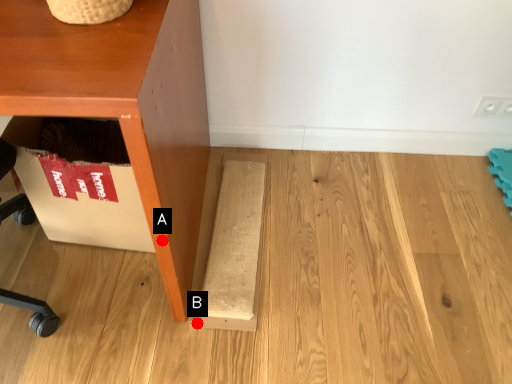
Question: Two points are circled on the image, labeled by A and B beside each circle. Which point is closer to the camera?

Choices:
 (A) A is closer
 (B) B is closer

Answer: (A)